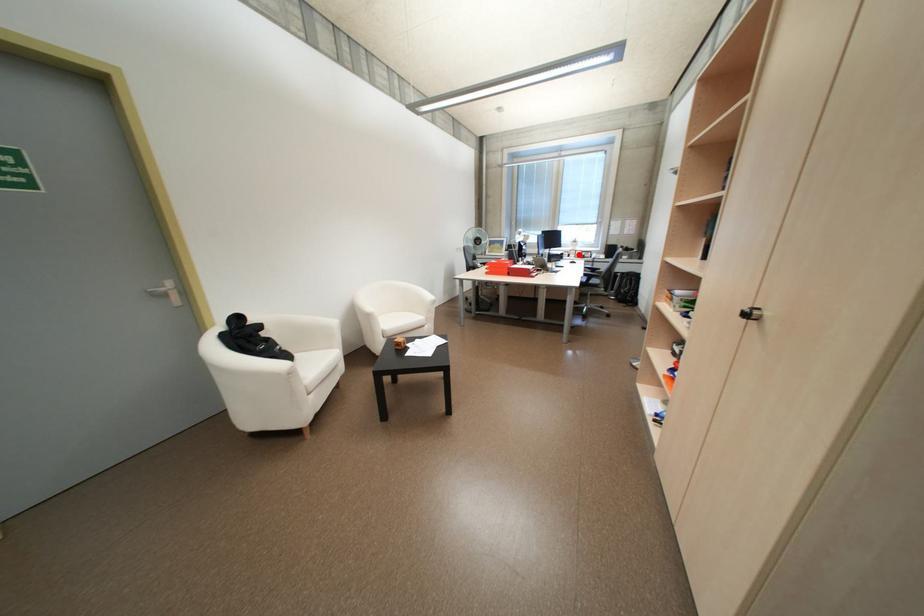
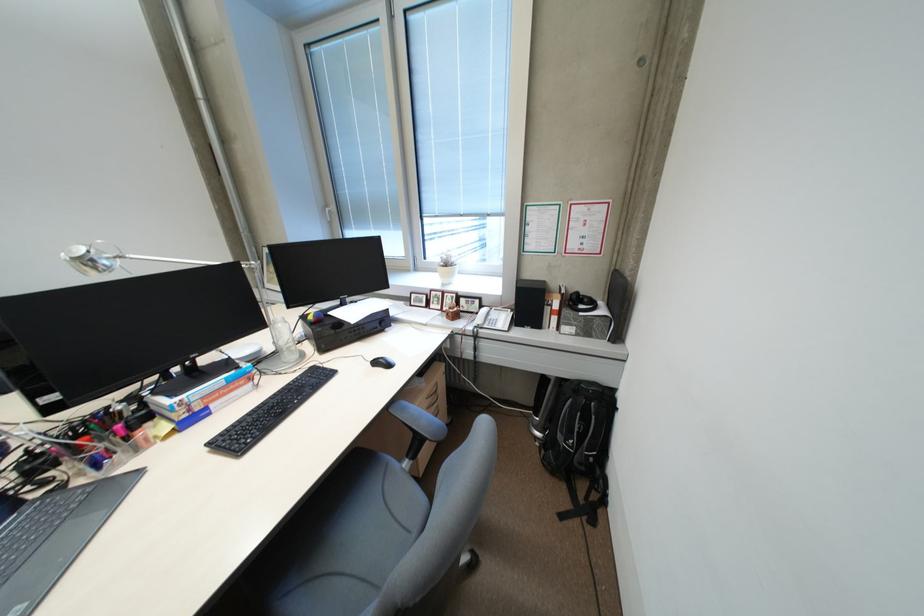
Find the pixel in the second image that matches the highlighted location in the first image.

(438, 304)